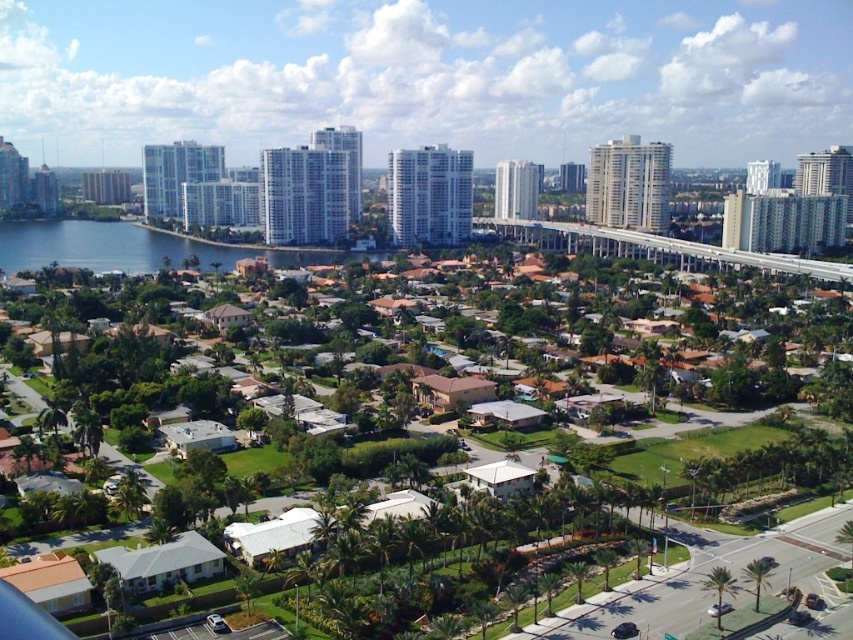
Can you confirm if green grass at center is positioned to the left of blue water at lower left?

In fact, green grass at center is to the right of blue water at lower left.

Which is more to the right, green grass at center or blue water at lower left?

green grass at center

Between point (332, 532) and point (113, 246), which one is positioned in front?

Point (332, 532) is more forward.

Identify the location of green grass at center. The height and width of the screenshot is (640, 853). (474, 525).